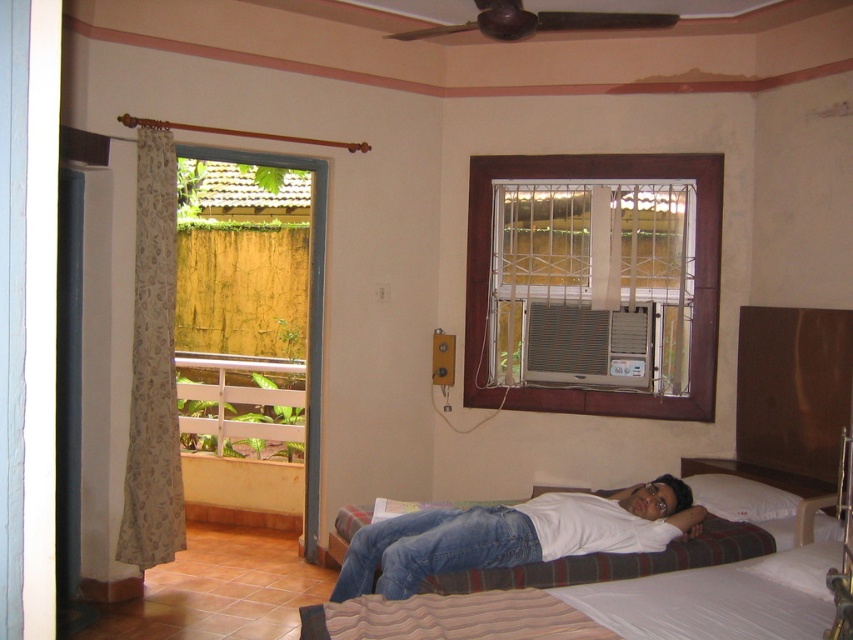
Does point (630, 496) lie in front of point (704, 419)?

That is True.

Between point (544, 497) and point (479, 344), which one is positioned behind?

Point (479, 344)

Who is more distant from viewer, (x=450, y=518) or (x=514, y=156)?

The point (x=514, y=156) is behind.

Where is `white matte shirt at center`? The width and height of the screenshot is (853, 640). white matte shirt at center is located at coordinates (514, 536).

Who is shorter, beige floral fabric curtain at left or white soft pillow at upper right?

Standing shorter between the two is white soft pillow at upper right.

Who is positioned more to the right, beige floral fabric curtain at left or white soft pillow at upper right?

Positioned to the right is white soft pillow at upper right.

Who is more forward, (135, 433) or (744, 493)?

Point (744, 493)

Find the location of a particular element. This screenshot has width=853, height=640. beige floral fabric curtain at left is located at coordinates (154, 368).

Does white fabric hospital bed at center have a greater width compared to white matte shirt at center?

Yes.

Between white fabric hospital bed at center and white matte shirt at center, which one appears on the right side from the viewer's perspective?

white fabric hospital bed at center

Who is more forward, (434,630) or (480,525)?

Point (434,630)

In order to click on white fabric hospital bed at center in this screenshot , I will do `click(606, 608)`.